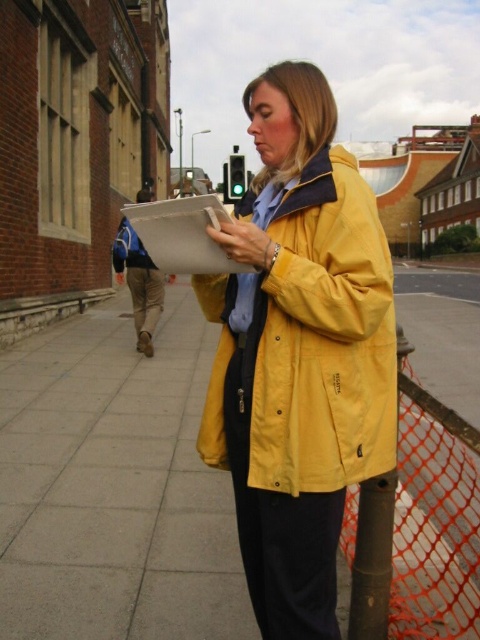
How much distance is there between yellow fabric jacket at center and yellow matte jacket at center?

yellow fabric jacket at center is 9.48 feet from yellow matte jacket at center.

Between point (339, 572) and point (305, 273), which one is positioned in front?

Positioned in front is point (305, 273).

Which is behind, point (207, 472) or point (243, 362)?

The point (207, 472) is more distant.

Where is `yellow fabric jacket at center`? yellow fabric jacket at center is located at coordinates (115, 484).